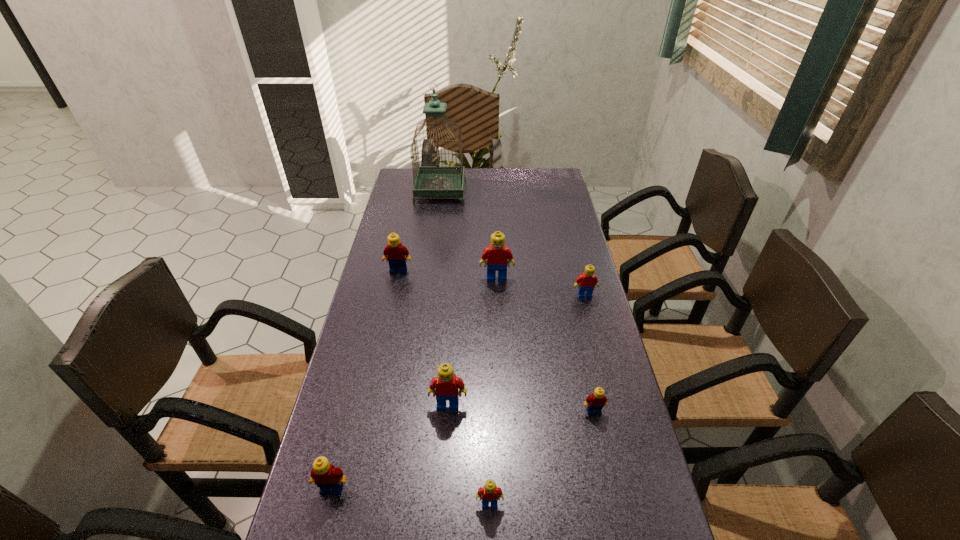
Where is `greenish birdcage`? The width and height of the screenshot is (960, 540). greenish birdcage is located at coordinates (430, 181).

Identify the location of birdcage. (430, 181).

Identify the location of the farthest red Lego. The width and height of the screenshot is (960, 540). (498, 256).

What are the coordinates of `the biggest red Lego` in the screenshot? It's located at (498, 256).

Where is `the farthest yellow Lego`? The height and width of the screenshot is (540, 960). the farthest yellow Lego is located at coordinates (394, 252).

Locate an element on the screen. the third Lego from left to right is located at coordinates (446, 386).

Where is `the third smallest red Lego`? Image resolution: width=960 pixels, height=540 pixels. the third smallest red Lego is located at coordinates (446, 386).

Identify the location of the fifth nearest object. (586, 282).

Image resolution: width=960 pixels, height=540 pixels. Find the location of `the third farthest Lego`. the third farthest Lego is located at coordinates (586, 282).

Find the location of `the sixth farthest Lego`. the sixth farthest Lego is located at coordinates (328, 478).